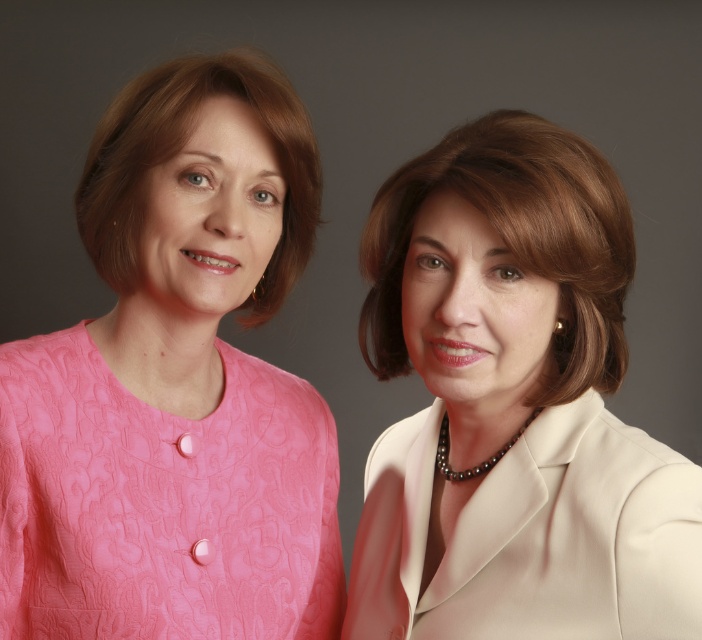
You are an artist trying to sketch the scene. You need to place the pink textured dress at left accurately. What are the coordinates where you should position it?

The pink textured dress at left should be positioned at coordinates point (161, 502).

You are a photographer setting up a shoot with two models wearing white satin blazers. The models are positioned against a gray background. According to the scene, which model is wearing the white satin blazer at center and which is wearing the white satin blazer at right?

The white satin blazer at center is actually positioned to the right of the white satin blazer at right. This means the model wearing the white satin blazer at right is on the far left side, while the one with the white satin blazer at center is slightly to the right of her.